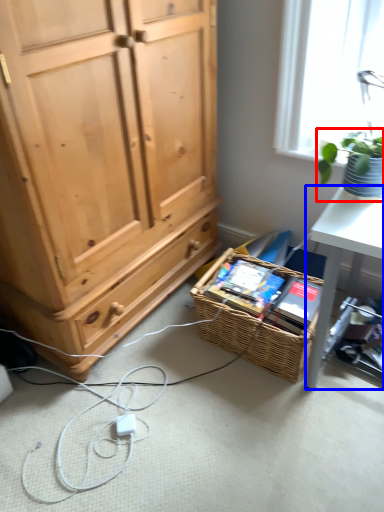
Question: Which of the following is the farthest to the observer, houseplant (highlighted by a red box) or desk (highlighted by a blue box)?

Choices:
 (A) houseplant
 (B) desk

Answer: (B)